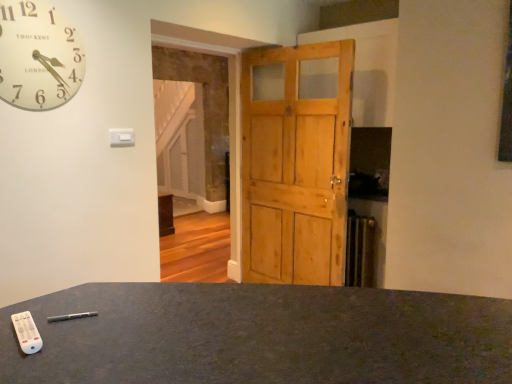
You are a GUI agent. You are given a task and a screenshot of the screen. Output one action in this format:
    pyautogui.click(x=<x>, y=<y>)
    Task: Click on the free space in front of white plastic remote at lower left
    
    Given the screenshot: What is the action you would take?
    pyautogui.click(x=25, y=359)